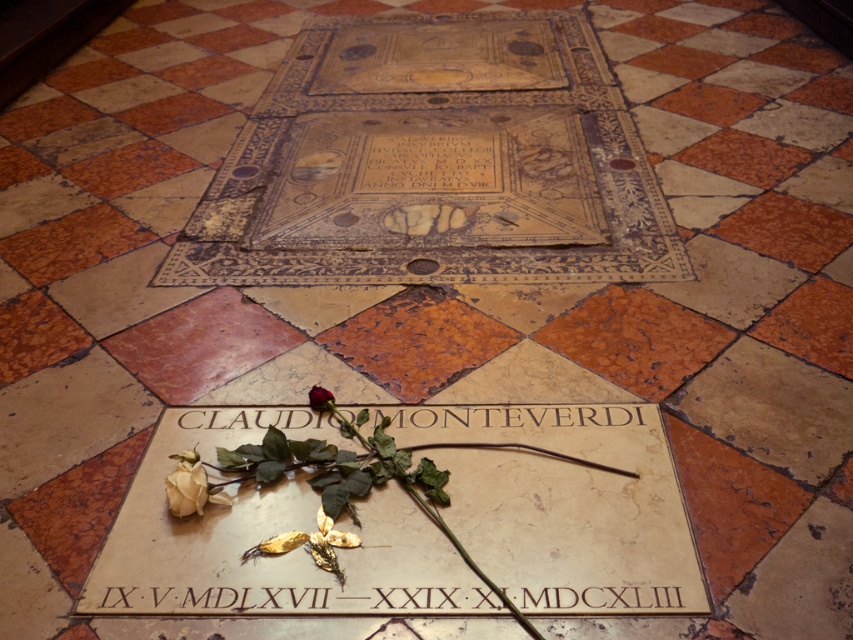
Can you confirm if beige marble plaque at center is bigger than deep red rose at center?

Correct, beige marble plaque at center is larger in size than deep red rose at center.

Measure the distance between point (245, 506) and camera.

1.72 meters

The image size is (853, 640). What do you see at coordinates (561, 502) in the screenshot?
I see `beige marble plaque at center` at bounding box center [561, 502].

Where is `beige marble plaque at center`? beige marble plaque at center is located at coordinates tap(561, 502).

Does white matte rose at lower left have a lesser height compared to deep red rose at center?

No, white matte rose at lower left is not shorter than deep red rose at center.

Where is `white matte rose at lower left`? The height and width of the screenshot is (640, 853). white matte rose at lower left is located at coordinates (186, 484).

Is beige marble plaque at center taller than white matte rose at lower left?

Correct, beige marble plaque at center is much taller as white matte rose at lower left.

Does beige marble plaque at center lie in front of white matte rose at lower left?

That is True.

Which is behind, point (543, 524) or point (186, 481)?

Point (186, 481)

Where is `beige marble plaque at center`? beige marble plaque at center is located at coordinates (561, 502).